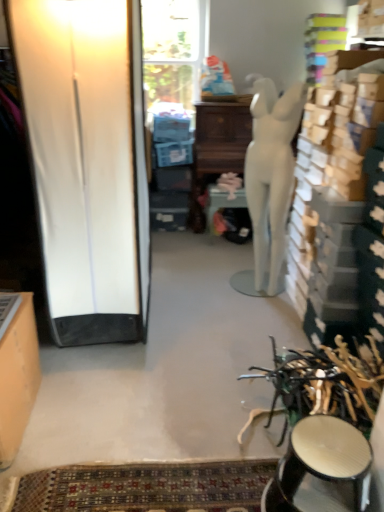
Find the location of a particular element. vacant area that lies between matte orange cabinet at left and white matte mannequin at center is located at coordinates (169, 347).